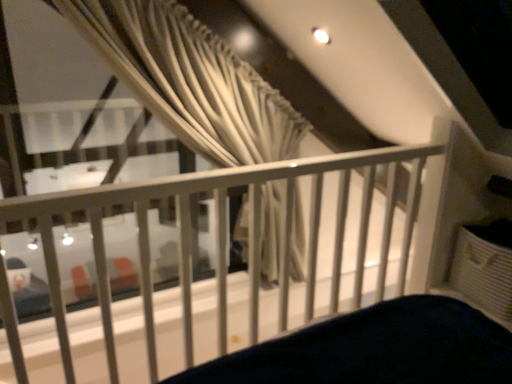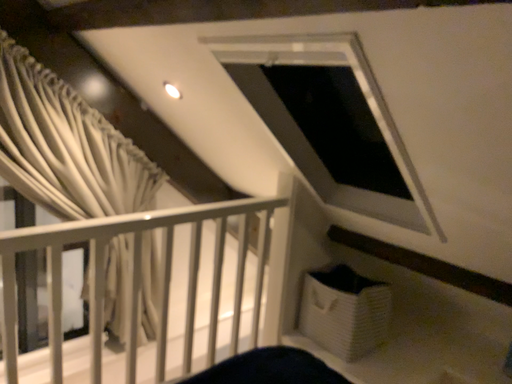
Question: Which way did the camera rotate in the video?

Choices:
 (A) rotated right
 (B) rotated left

Answer: (A)